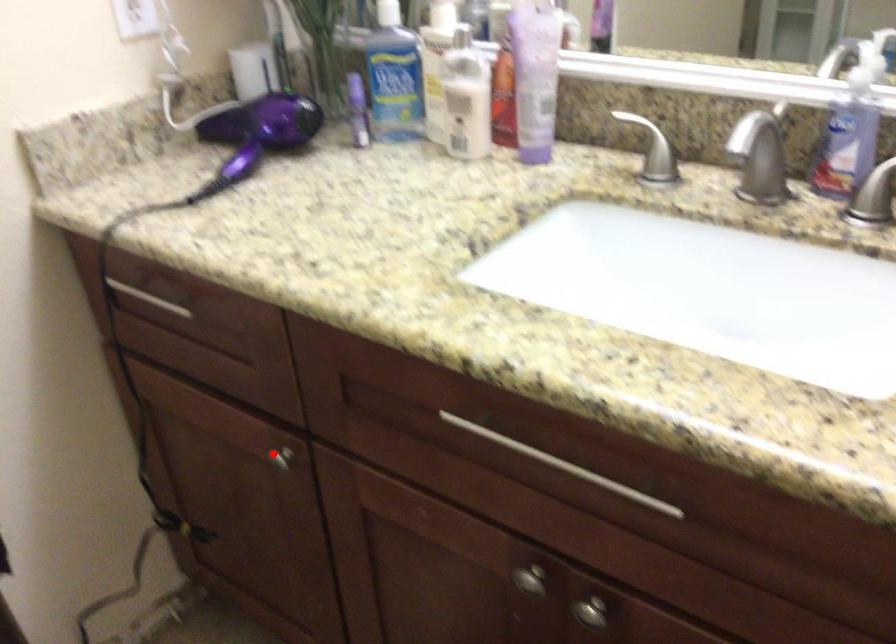
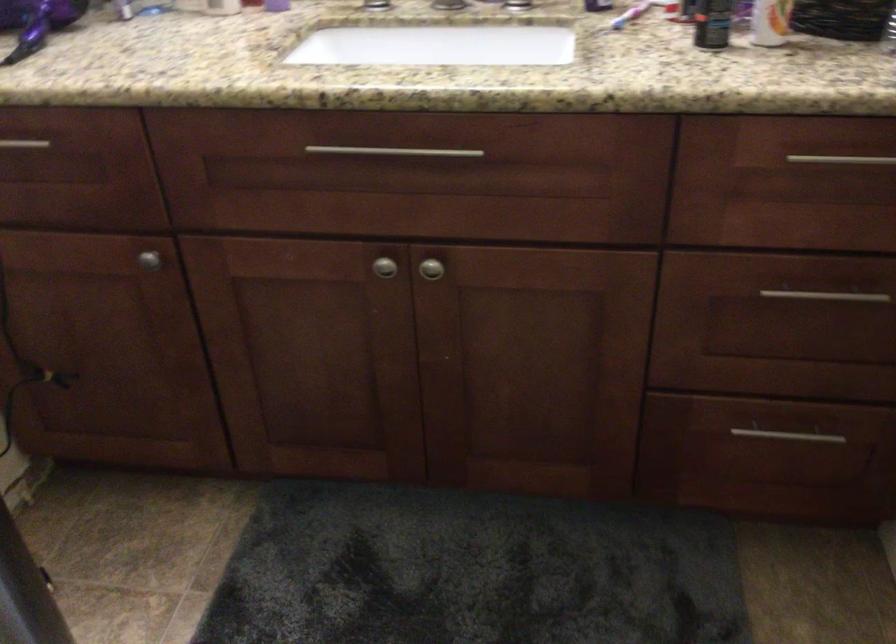
Question: I am providing you with two images of the same scene from different viewpoints. Image1 has a red point marked. In image2, the corresponding 3D location appears at what relative position? Reply with the corresponding letter.

Choices:
 (A) Closer
 (B) Farther

Answer: (B)